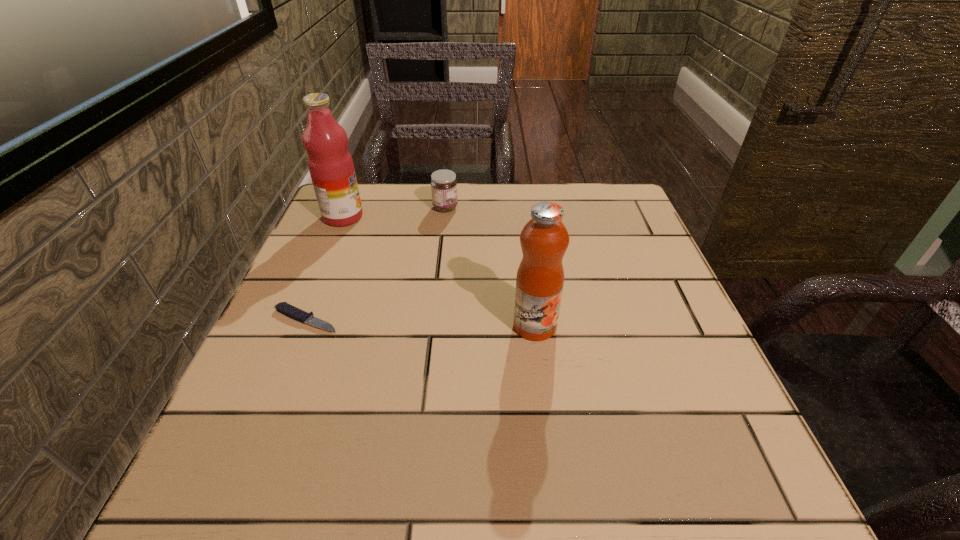
You are a GUI agent. You are given a task and a screenshot of the screen. Output one action in this format:
    pyautogui.click(x=<x>, y=<y>)
    Task: Click on the farther fruit juice
    
    Given the screenshot: What is the action you would take?
    pyautogui.click(x=331, y=167)

Locate an element on the screen. The image size is (960, 540). the nearer fruit juice is located at coordinates (544, 239).

You are a GUI agent. You are given a task and a screenshot of the screen. Output one action in this format:
    pyautogui.click(x=<x>, y=<y>)
    Task: Click on the rightmost object
    
    Given the screenshot: What is the action you would take?
    pyautogui.click(x=544, y=239)

This screenshot has height=540, width=960. In order to click on the second object from right to left in this screenshot , I will do `click(443, 184)`.

Identify the location of jam. The image size is (960, 540). (443, 184).

I want to click on the shortest object, so click(284, 308).

Identify the location of vacant space located on the label of the left fruit juice. (392, 217).

Identify the location of vacant region located on the front label of the right fruit juice. This screenshot has height=540, width=960. (553, 471).

This screenshot has width=960, height=540. I want to click on vacant area situated 0.080m on the front label of the jam, so click(490, 207).

Identify the location of blank space located on the back of the steak knife. (356, 197).